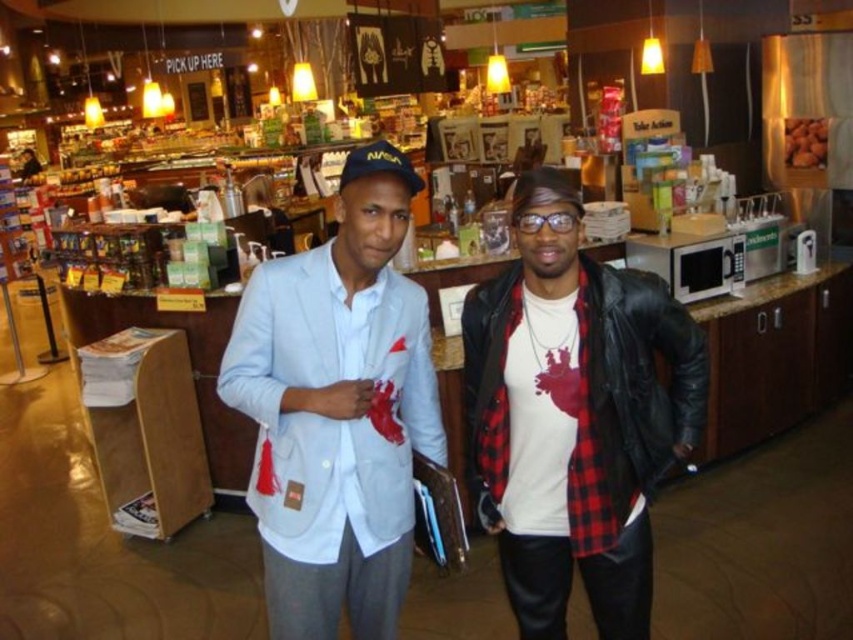
You are a delivery robot with a 2.5 meter reach. You need to pick up the brown matte nuts at upper right from your current position near the light blue cotton blazer at center. Can your arm reach them?

The distance between the light blue cotton blazer at center and the brown matte nuts at upper right is 3.67 meters. Since your arm only reaches 2.5 meters, you cannot reach the brown matte nuts at upper right.

You are taking a photo of the two points in the image. Which point, point [311,563] or point [822,118], will appear larger in your photo?

Point [311,563] will appear larger in the photo because it is closer to the camera than point [822,118].